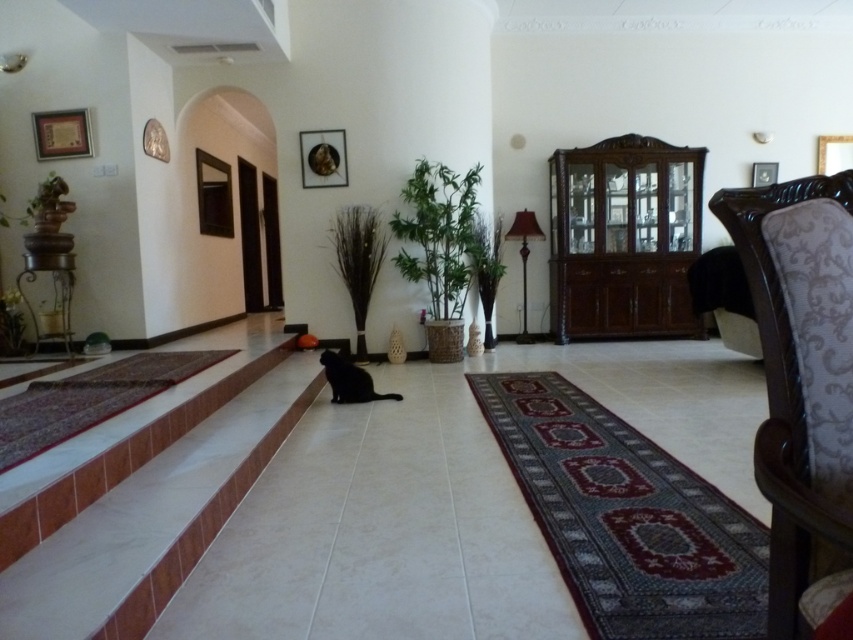
Does dark wood cabinet at center appear on the left side of black matte cat at center?

No, dark wood cabinet at center is not to the left of black matte cat at center.

Between dark wood cabinet at center and black matte cat at center, which one is positioned lower?

black matte cat at center is below.

Who is more distant from viewer, (675,275) or (323,369)?

Point (675,275)

What are the coordinates of `dark wood cabinet at center` in the screenshot? It's located at (624, 237).

Between white tile stairs at center and black matte cat at center, which one appears on the right side from the viewer's perspective?

From the viewer's perspective, black matte cat at center appears more on the right side.

Which is below, white tile stairs at center or black matte cat at center?

white tile stairs at center is below.

Between point (71, 592) and point (352, 388), which one is positioned in front?

Point (71, 592) is in front.

Find the location of `white tile stairs at center`. white tile stairs at center is located at coordinates coord(148,508).

Is point (10, 608) closer to viewer compared to point (598, 296)?

That is True.

Which of these two, white tile stairs at center or dark wood cabinet at center, stands taller?

dark wood cabinet at center

Identify the location of white tile stairs at center. This screenshot has width=853, height=640. (148, 508).